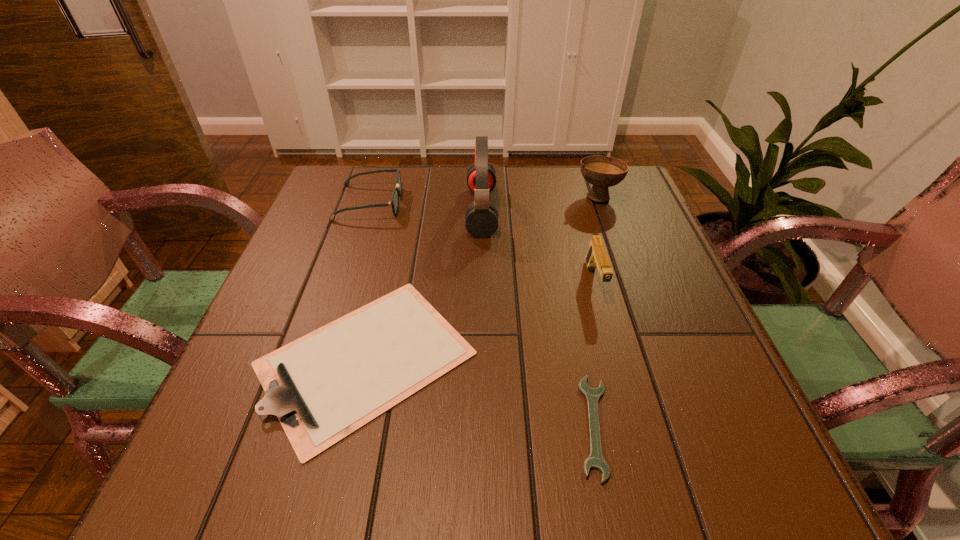
At what (x,y) coordinates should I click in order to perform the action: click on the tallest object. Please return your answer as a coordinate pair (x, y). The image size is (960, 540). Looking at the image, I should click on (481, 218).

You are a GUI agent. You are given a task and a screenshot of the screen. Output one action in this format:
    pyautogui.click(x=<x>, y=<y>)
    Task: Click on the soup bowl
    This screenshot has height=540, width=960.
    Given the screenshot: What is the action you would take?
    pyautogui.click(x=602, y=172)

Image resolution: width=960 pixels, height=540 pixels. What are the coordinates of `the fifth shortest object` in the screenshot? It's located at (602, 172).

Identify the location of pistol. The image size is (960, 540). (596, 256).

At what (x,y) coordinates should I click in order to perform the action: click on the fifth object from left to right. Please return your answer as a coordinate pair (x, y). Looking at the image, I should click on pyautogui.click(x=596, y=256).

This screenshot has height=540, width=960. Identify the location of the fourth tallest object. pos(394,202).

The width and height of the screenshot is (960, 540). What are the coordinates of `the second shortest object` in the screenshot? It's located at (323, 387).

Locate an element on the screen. This screenshot has height=540, width=960. the fourth object from left to right is located at coordinates (595, 460).

Where is `wrench`? wrench is located at coordinates (595, 460).

Where is `free spot located 0.190m on the ear cups of the tallest object`? This screenshot has width=960, height=540. free spot located 0.190m on the ear cups of the tallest object is located at coordinates (392, 211).